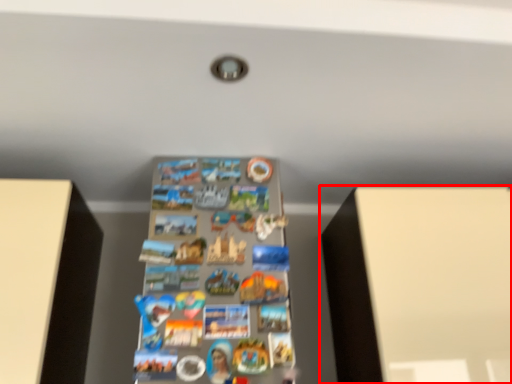
Question: From the image's perspective, considering the relative positions of furniture (annotated by the red box) and shelf in the image provided, where is furniture (annotated by the red box) located with respect to the staircase?

Choices:
 (A) below
 (B) above

Answer: (A)